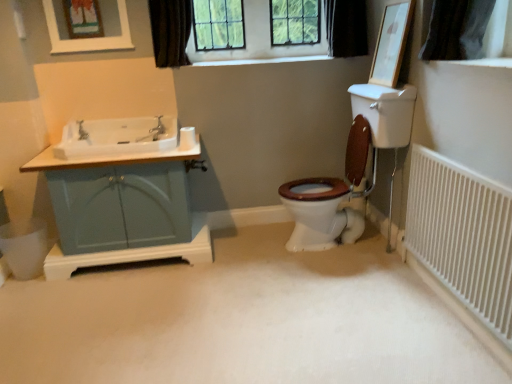
Locate an element on the screen. The image size is (512, 384). unoccupied region to the right of brushed metal faucet at left is located at coordinates (113, 136).